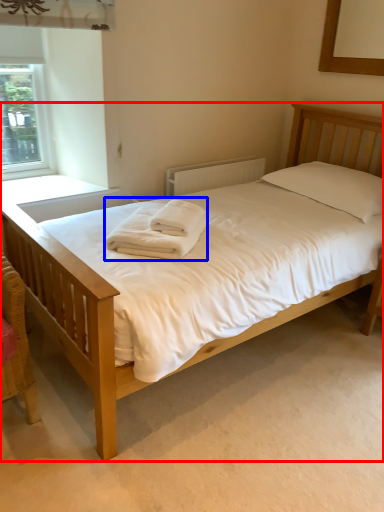
Question: Among these objects, which one is nearest to the camera, bed (highlighted by a red box) or bath towel (highlighted by a blue box)?

Choices:
 (A) bed
 (B) bath towel

Answer: (A)